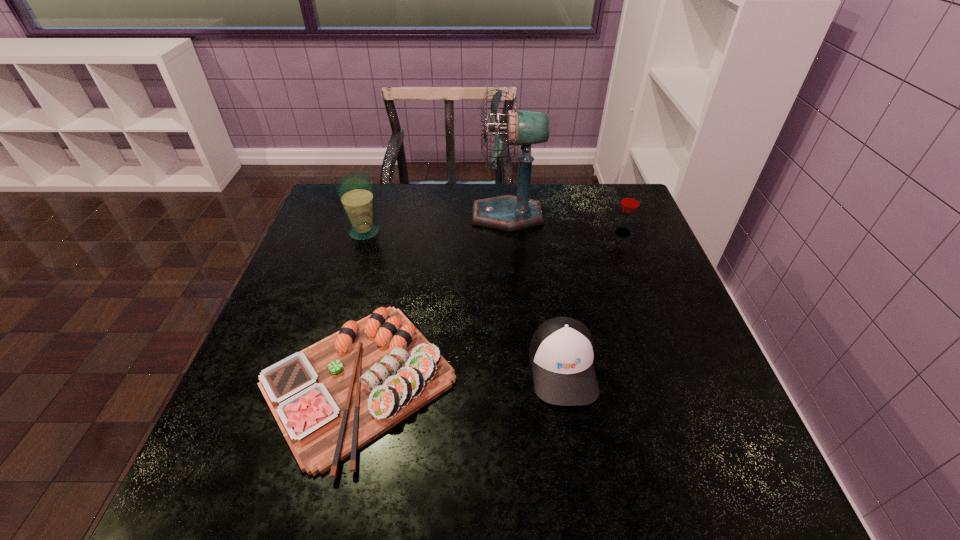
Locate an element on the screen. This screenshot has width=960, height=540. the tallest object is located at coordinates (509, 213).

Find the location of a particular element. the left glass is located at coordinates (355, 190).

Locate an element on the screen. the taller glass is located at coordinates (355, 190).

You are a GUI agent. You are given a task and a screenshot of the screen. Output one action in this format:
    pyautogui.click(x=<x>, y=<y>)
    Task: Click on the third shortest object
    Image resolution: width=960 pixels, height=540 pixels.
    Given the screenshot: What is the action you would take?
    pyautogui.click(x=630, y=202)

At what (x,y) coordinates should I click in order to perform the action: click on the shorter glass. Please return your answer as a coordinate pair (x, y). The image size is (960, 540). Looking at the image, I should click on (630, 202).

The width and height of the screenshot is (960, 540). Find the location of `cap`. cap is located at coordinates (562, 349).

Find the location of a particular element. This screenshot has height=540, width=960. the shortest object is located at coordinates (331, 399).

I want to click on free region located 0.370m in front of the tallest object where the wind blows, so click(x=347, y=215).

Identify the location of free region located 0.200m in front of the tallest object where the wind blows. (404, 215).

This screenshot has width=960, height=540. I want to click on vacant space situated in front of the tallest object where the wind blows, so click(431, 215).